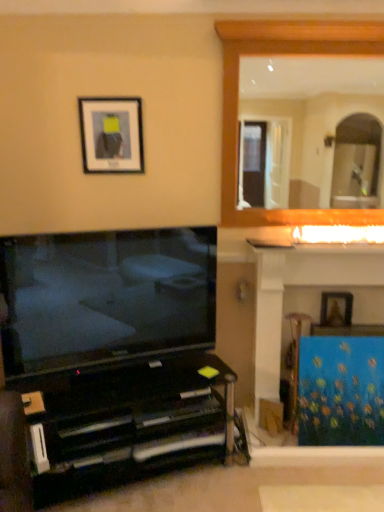
Question: Does wooden picture frame at upper right, which appears as the second picture frame when viewed from the top, come behind blue fabric at right?

Choices:
 (A) yes
 (B) no

Answer: (A)

Question: Is wooden picture frame at upper right, which ranks as the first picture frame in bottom-to-top order, aimed at blue fabric at right?

Choices:
 (A) no
 (B) yes

Answer: (A)

Question: Is wooden picture frame at upper right, which ranks as the first picture frame in bottom-to-top order, smaller than blue fabric at right?

Choices:
 (A) yes
 (B) no

Answer: (A)

Question: Does wooden picture frame at upper right, which ranks as the first picture frame in bottom-to-top order, appear on the left side of blue fabric at right?

Choices:
 (A) yes
 (B) no

Answer: (B)

Question: From a real-world perspective, does wooden picture frame at upper right, placed as the first picture frame when sorted from back to front, stand above blue fabric at right?

Choices:
 (A) no
 (B) yes

Answer: (B)

Question: Based on their sizes in the image, would you say blue fabric at right is bigger or smaller than black glossy entertainment center at lower left?

Choices:
 (A) small
 (B) big

Answer: (A)

Question: In the image, is blue fabric at right positioned in front of or behind black glossy entertainment center at lower left?

Choices:
 (A) front
 (B) behind

Answer: (B)

Question: Does point (344, 379) appear closer or farther from the camera than point (100, 475)?

Choices:
 (A) farther
 (B) closer

Answer: (A)

Question: From a real-world perspective, relative to black glossy entertainment center at lower left, is blue fabric at right vertically above or below?

Choices:
 (A) below
 (B) above

Answer: (B)

Question: Looking at the image, does matte black tv at lower left seem bigger or smaller compared to wooden picture frame at upper right, which ranks as the first picture frame in bottom-to-top order?

Choices:
 (A) big
 (B) small

Answer: (A)

Question: Visually, is matte black tv at lower left positioned to the left or to the right of wooden picture frame at upper right, placed as the first picture frame when sorted from back to front?

Choices:
 (A) right
 (B) left

Answer: (B)

Question: Is matte black tv at lower left taller or shorter than wooden picture frame at upper right, which is the 2th picture frame from left to right?

Choices:
 (A) tall
 (B) short

Answer: (A)

Question: Looking at their shapes, would you say matte black tv at lower left is wider or thinner than wooden picture frame at upper right, which ranks as the first picture frame in bottom-to-top order?

Choices:
 (A) wide
 (B) thin

Answer: (A)

Question: Considering the positions of point (261, 268) and point (268, 185), is point (261, 268) closer or farther from the camera than point (268, 185)?

Choices:
 (A) farther
 (B) closer

Answer: (B)

Question: In the image, is blue canvas painting at right on the left side or the right side of wooden frame at upper right?

Choices:
 (A) left
 (B) right

Answer: (B)